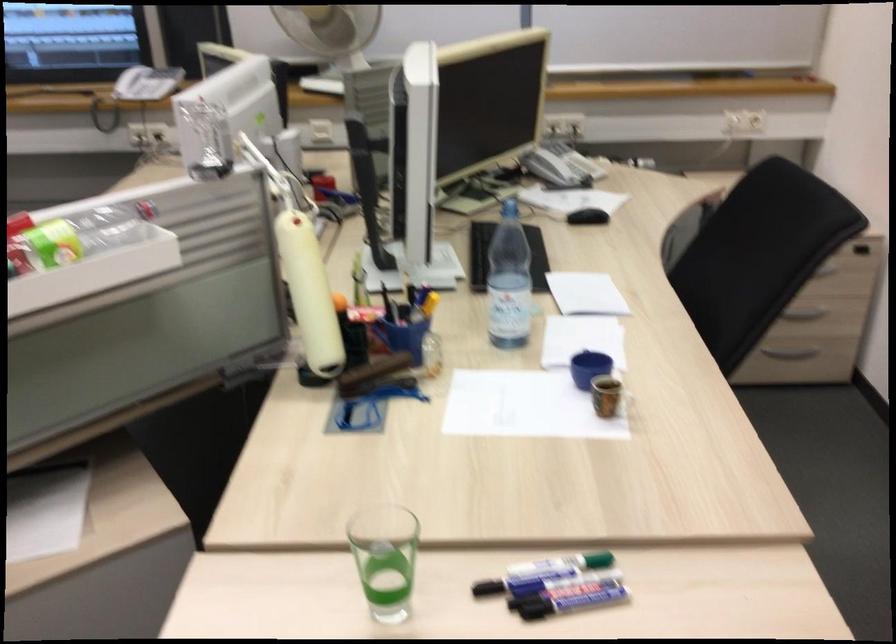
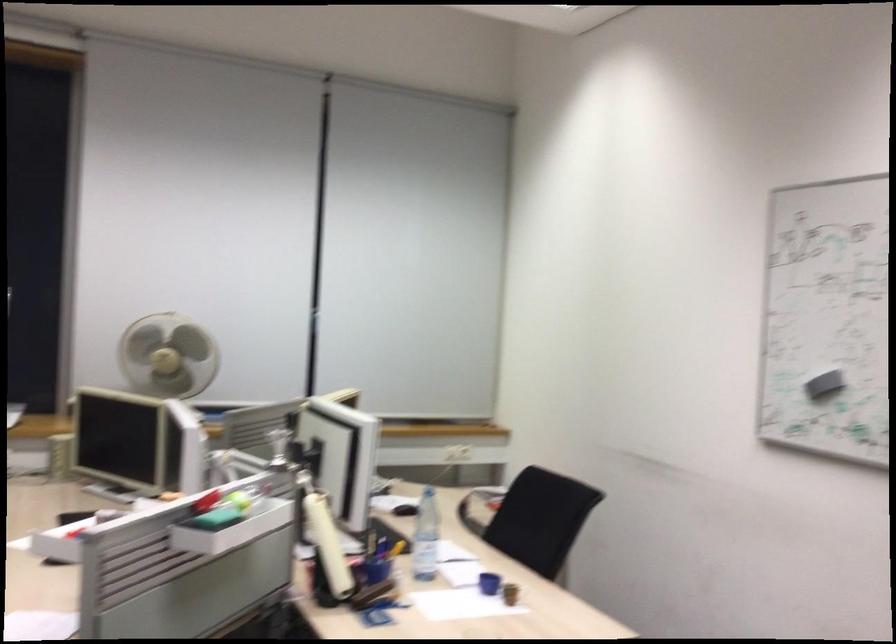
Locate, in the second image, the point that corresponds to [754,268] in the first image.

(531, 518)